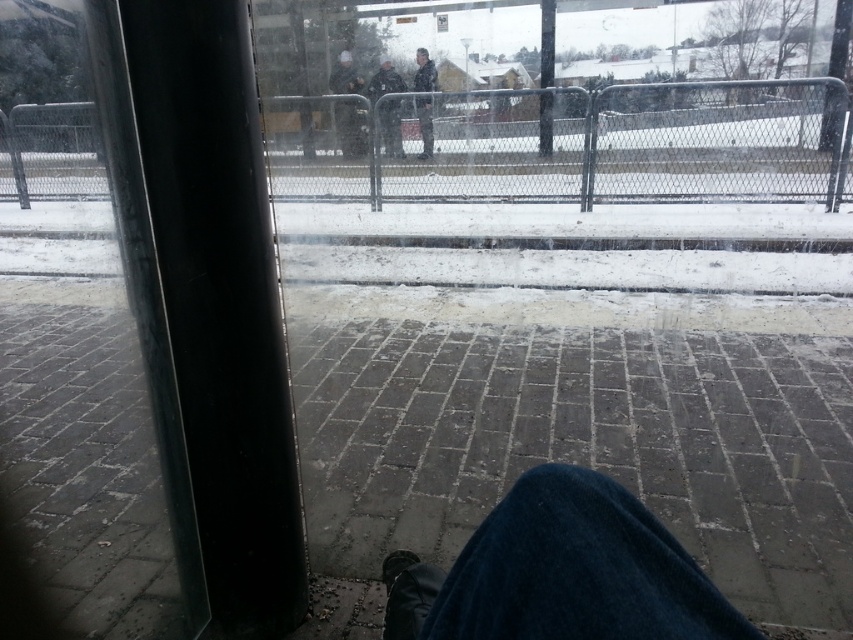
Question: Which of the following is the farthest from the observer?

Choices:
 (A) (381, 120)
 (B) (479, 301)
 (C) (347, 92)

Answer: (C)

Question: Is gray concrete pavement at center thinner than dark gray jacket at center?

Choices:
 (A) yes
 (B) no

Answer: (B)

Question: Which object appears closest to the camera in this image?

Choices:
 (A) dark blue uniform at center
 (B) dark gray uniform at center
 (C) dark gray jacket at center

Answer: (B)

Question: Is dark blue uniform at center smaller than dark gray jacket at center?

Choices:
 (A) no
 (B) yes

Answer: (A)

Question: Which of the following is the closest to the observer?

Choices:
 (A) (370, 99)
 (B) (340, 108)
 (C) (416, 76)

Answer: (B)

Question: Does gray concrete pavement at center appear on the right side of dark gray uniform at center?

Choices:
 (A) yes
 (B) no

Answer: (A)